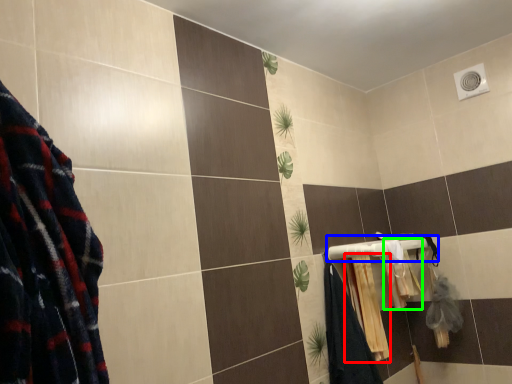
Question: Estimate the real-world distances between objects in this image. Which object is farther from bath towel (highlighted by a red box), towel bar (highlighted by a blue box) or bath towel (highlighted by a green box)?

Choices:
 (A) towel bar
 (B) bath towel

Answer: (B)